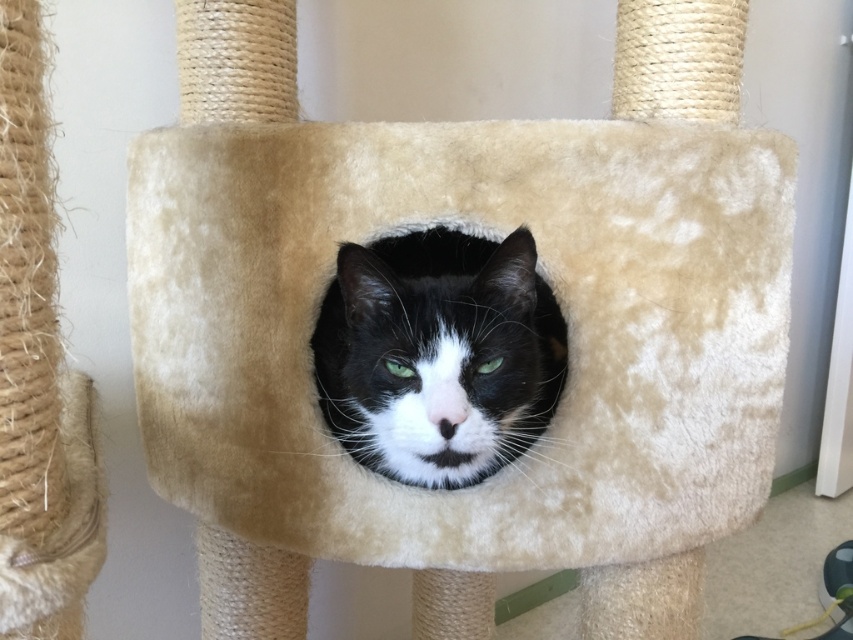
At what (x,y) coordinates should I click in order to perform the action: click on beige plush cat bed at center. Please return your answer as a coordinate pair (x, y). The width and height of the screenshot is (853, 640). Looking at the image, I should click on (546, 278).